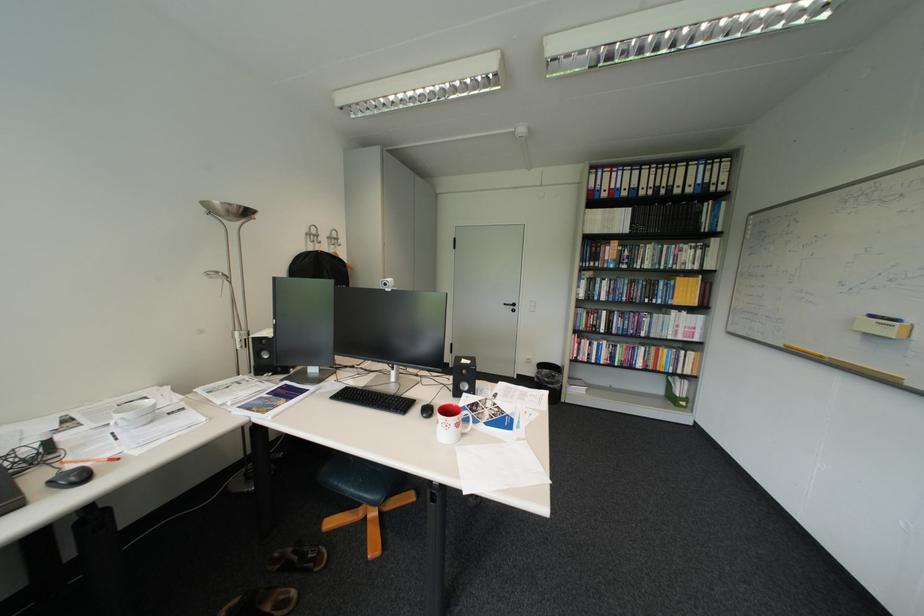
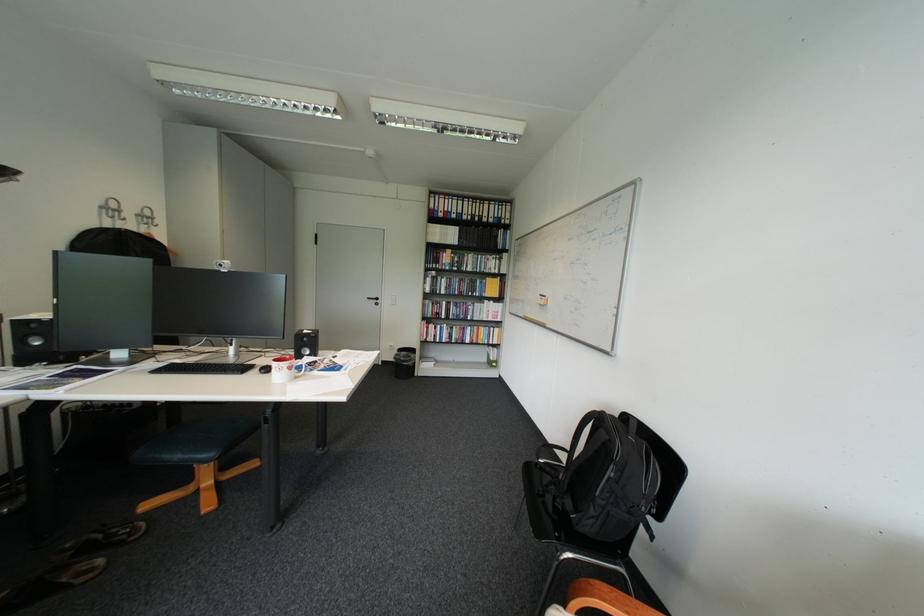
In a continuous first-person perspective shot, in which direction is the camera moving?

The cameraman moved toward right, backward.